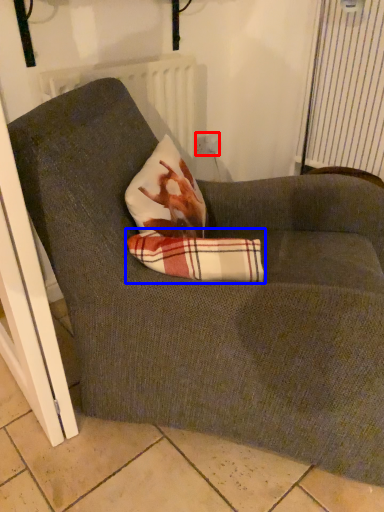
Question: Which point is closer to the camera, electric outlet (highlighted by a red box) or plaid (highlighted by a blue box)?

Choices:
 (A) electric outlet
 (B) plaid

Answer: (B)